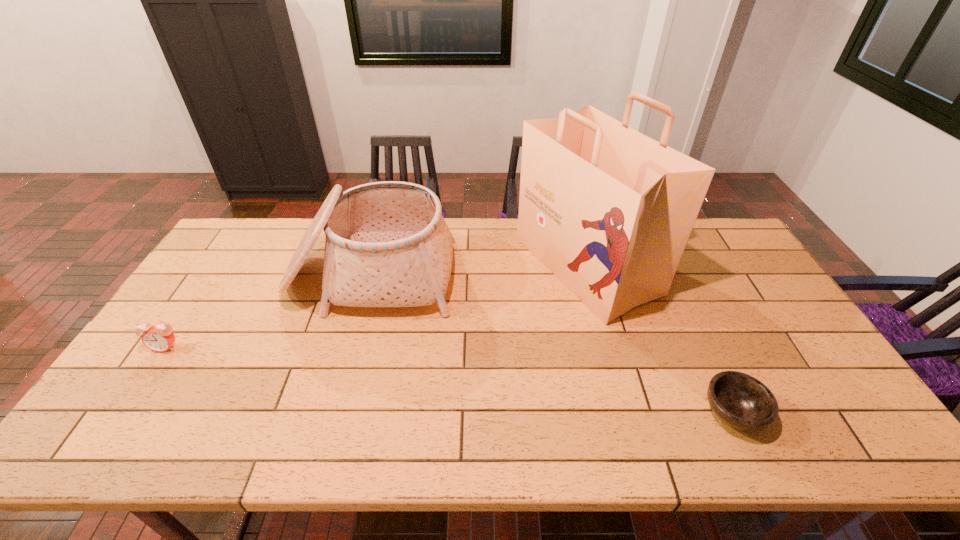
The height and width of the screenshot is (540, 960). I want to click on the second closest object to the bowl, so click(387, 244).

Identify which object is the closest to the nearest object. Please provide its 2D coordinates. Your answer should be formatted as a tuple, i.e. [(x, y)], where the tuple contains the x and y coordinates of a point satisfying the conditions above.

[(609, 211)]

What are the coordinates of `free location that satisfies the following two spatial constraints: 1. with the lid open on the bowl; 2. on the right side of the second tallest object` in the screenshot? It's located at (332, 413).

The height and width of the screenshot is (540, 960). I want to click on vacant space that satisfies the following two spatial constraints: 1. on the clock face of the alarm clock; 2. on the right side of the shortest object, so click(121, 413).

The height and width of the screenshot is (540, 960). Find the location of `vacant position in the image that satisfies the following two spatial constraints: 1. on the side of the grocery bag with the superhero design; 2. on the clock face of the leftmost object`. vacant position in the image that satisfies the following two spatial constraints: 1. on the side of the grocery bag with the superhero design; 2. on the clock face of the leftmost object is located at coordinates (609, 347).

In order to click on vacant area that satisfies the following two spatial constraints: 1. on the side of the grocery bag with the superhero design; 2. with the lid open on the basket in this screenshot , I will do `click(588, 275)`.

I want to click on free point that satisfies the following two spatial constraints: 1. on the side of the grocery bag with the superhero design; 2. on the clock face of the alarm clock, so (x=609, y=347).

Where is `vacant space that satisfies the following two spatial constraints: 1. with the lid open on the shortest object; 2. on the left side of the second object from left to right`? The width and height of the screenshot is (960, 540). vacant space that satisfies the following two spatial constraints: 1. with the lid open on the shortest object; 2. on the left side of the second object from left to right is located at coordinates point(332,413).

Locate an element on the screen. The width and height of the screenshot is (960, 540). free space in the image that satisfies the following two spatial constraints: 1. on the side of the grocery bag with the superhero design; 2. with the lid open on the basket is located at coordinates (588, 275).